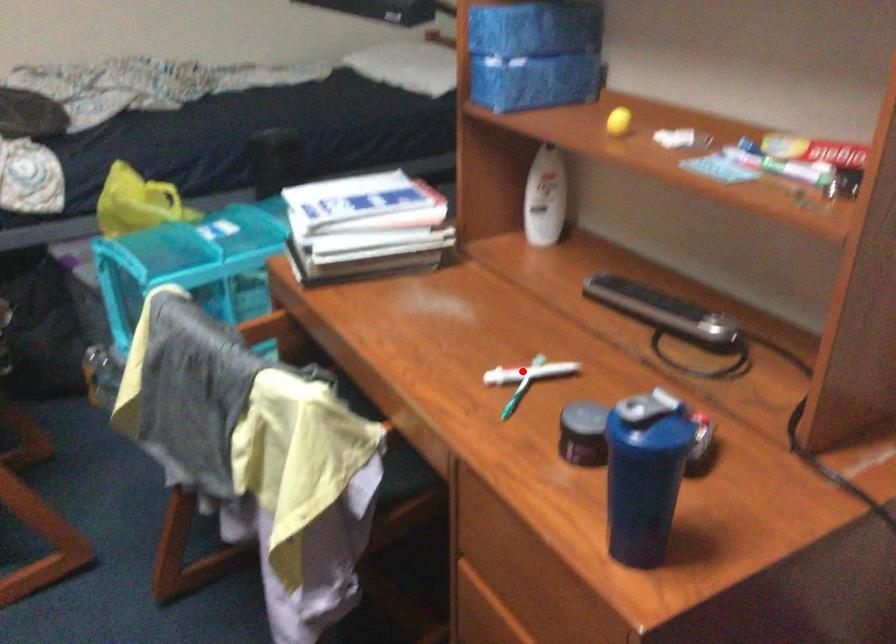
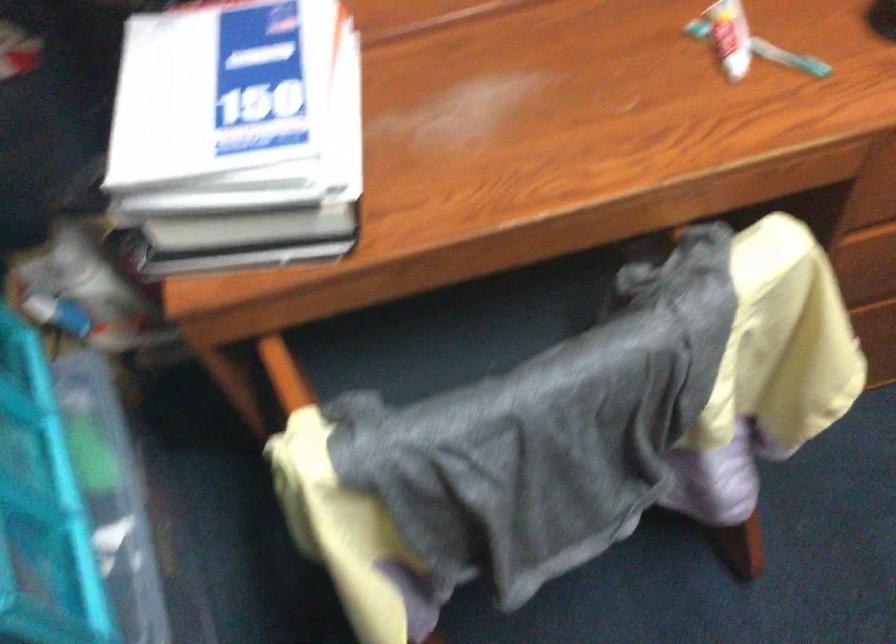
Find the pixel in the second image that matches the highlighted location in the first image.

(730, 37)